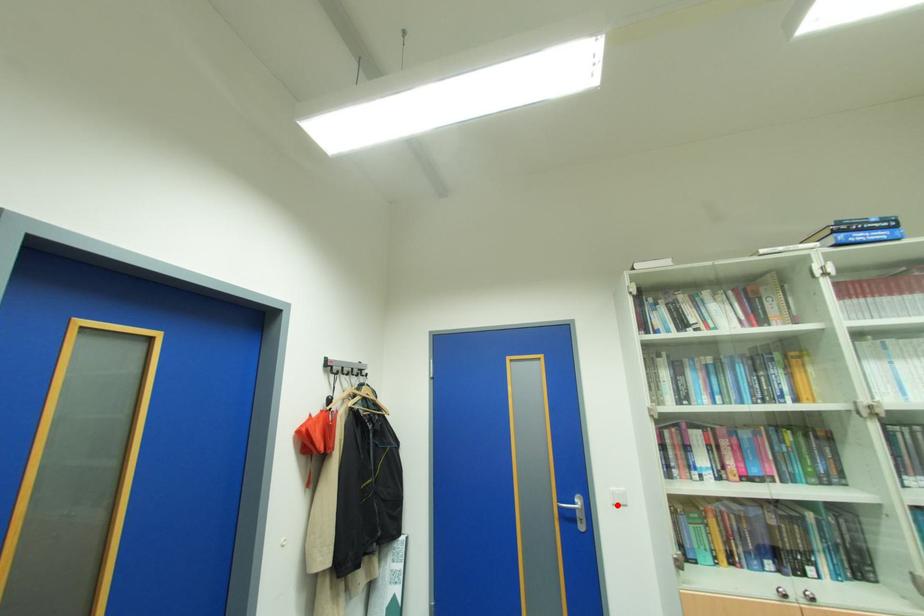
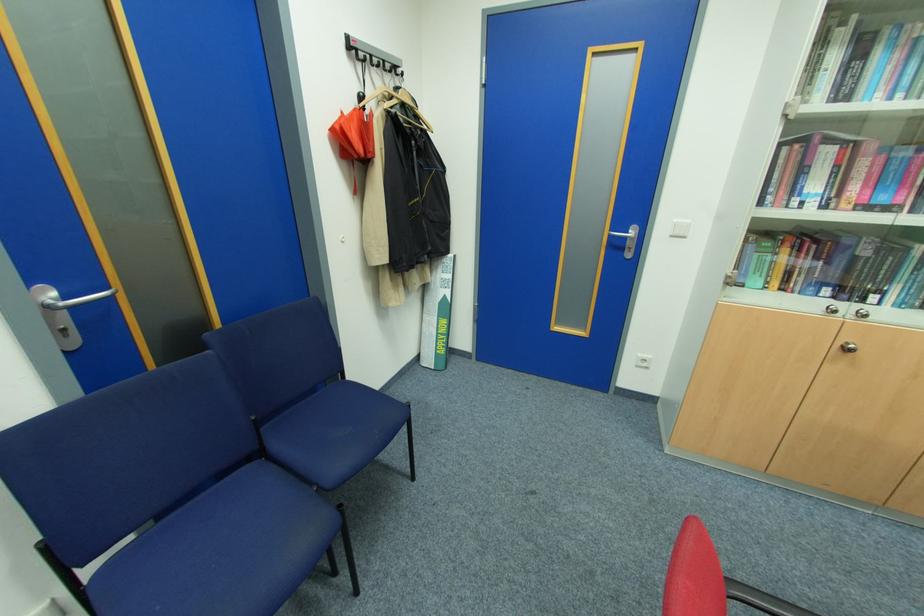
Find the pixel in the second image that matches the highlighted location in the first image.

(675, 236)